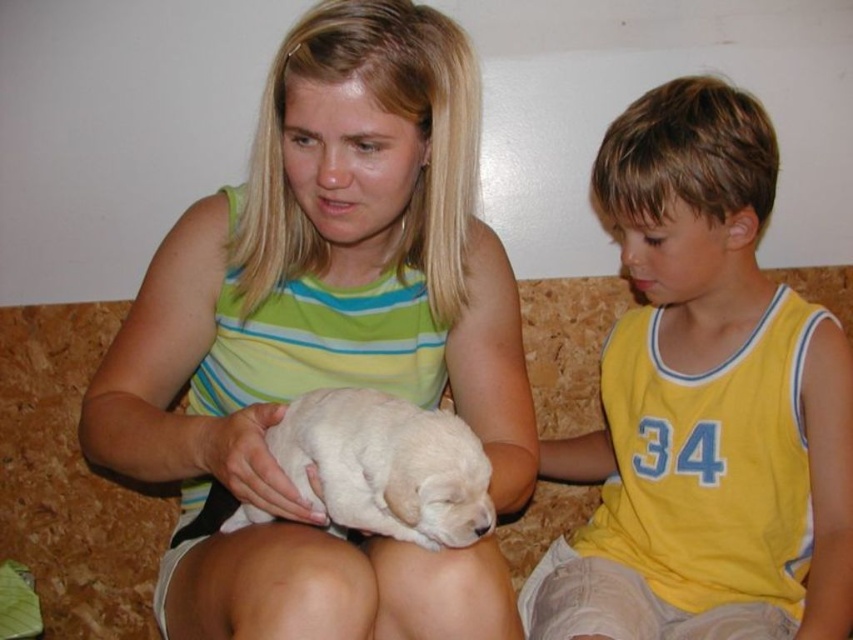
Between white soft fur at center and white fur puppy at center, which one appears on the left side from the viewer's perspective?

Positioned to the left is white soft fur at center.

Who is more distant from viewer, (373,74) or (347,432)?

Point (373,74)

Where is `white soft fur at center`? This screenshot has width=853, height=640. white soft fur at center is located at coordinates (328, 336).

Can you confirm if white soft fur at center is positioned to the right of yellow jersey at right?

No, white soft fur at center is not to the right of yellow jersey at right.

Does point (357, 13) come closer to viewer compared to point (724, 348)?

Yes, it is in front of point (724, 348).

Consider the image. Who is more distant from viewer, (265, 401) or (753, 392)?

The point (753, 392) is behind.

The height and width of the screenshot is (640, 853). What are the coordinates of `white soft fur at center` in the screenshot? It's located at (328, 336).

From the picture: Does yellow jersey at right appear on the right side of white fur puppy at center?

Correct, you'll find yellow jersey at right to the right of white fur puppy at center.

Is yellow jersey at right to the left of white fur puppy at center from the viewer's perspective?

In fact, yellow jersey at right is to the right of white fur puppy at center.

Identify the location of yellow jersey at right. The image size is (853, 640). (704, 404).